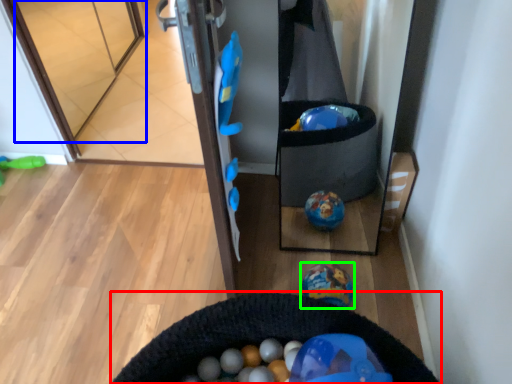
Question: Based on their relative distances, which object is nearer to cat bed (highlighted by a red box)? Choose from glass door (highlighted by a blue box) and toy (highlighted by a green box).

Choices:
 (A) glass door
 (B) toy

Answer: (B)